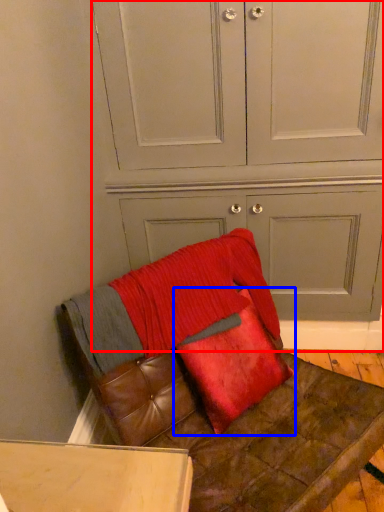
Question: Among these objects, which one is farthest to the camera, dresser (highlighted by a red box) or pillow (highlighted by a blue box)?

Choices:
 (A) dresser
 (B) pillow

Answer: (A)